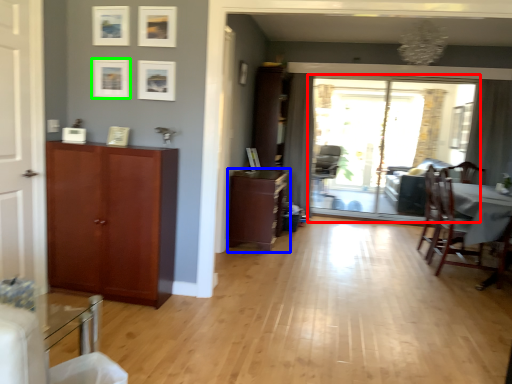
Question: Which object is the farthest from window screen (highlighted by a red box)? Choose among these: cabinetry (highlighted by a blue box) or picture frame (highlighted by a green box).

Choices:
 (A) cabinetry
 (B) picture frame

Answer: (B)